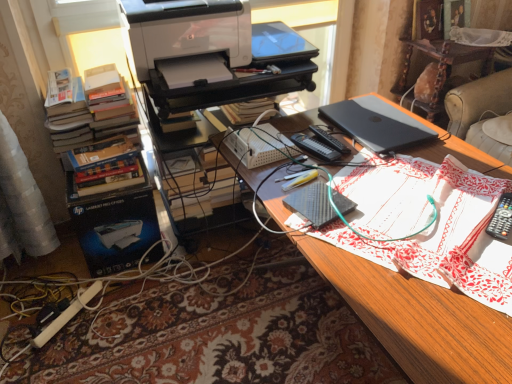
Image resolution: width=512 pixels, height=384 pixels. I want to click on vacant space to the right of black textured notebook at center, so click(x=386, y=206).